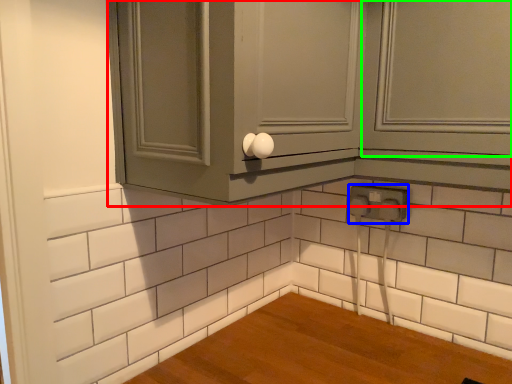
Question: Based on their relative distances, which object is nearer to cabinetry (highlighted by a red box)? Choose from electric outlet (highlighted by a blue box) and window (highlighted by a green box).

Choices:
 (A) electric outlet
 (B) window

Answer: (B)